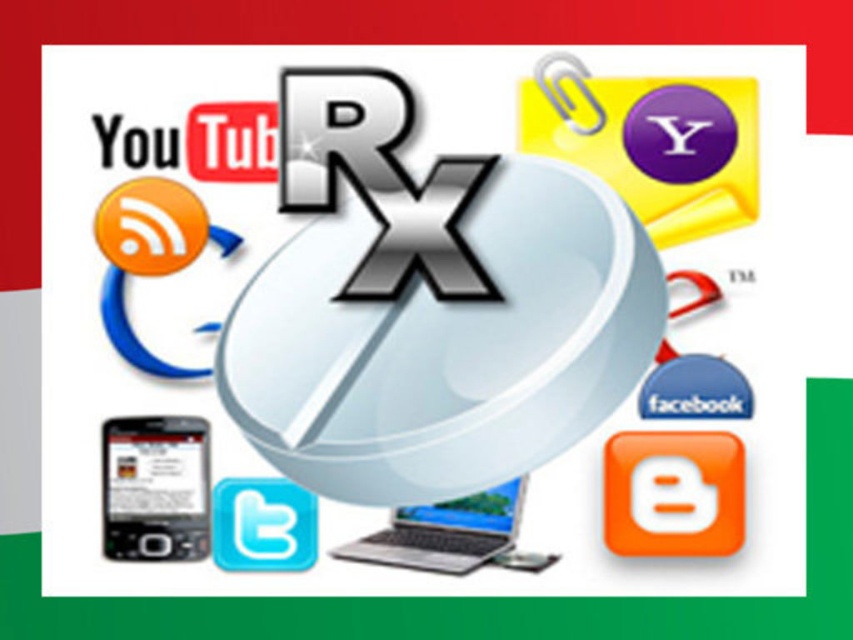
Consider the image. Can you confirm if black glossy phone at bottom left is bigger than satin silver laptop at center?

Actually, black glossy phone at bottom left might be smaller than satin silver laptop at center.

Is black glossy phone at bottom left to the left of satin silver laptop at center from the viewer's perspective?

Correct, you'll find black glossy phone at bottom left to the left of satin silver laptop at center.

Does point (129, 436) come closer to viewer compared to point (427, 509)?

Yes, point (129, 436) is closer to viewer.

Locate an element on the screen. The width and height of the screenshot is (853, 640). black glossy phone at bottom left is located at coordinates (155, 488).